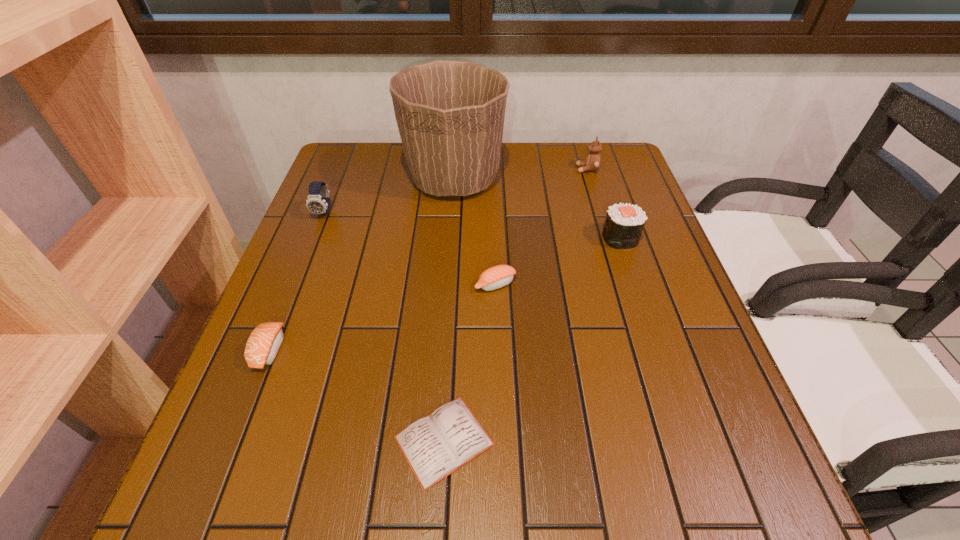
The image size is (960, 540). In order to click on free space at the left edge of the desktop in this screenshot , I will do `click(238, 377)`.

Locate an element on the screen. The image size is (960, 540). vacant space at the right edge of the desktop is located at coordinates (613, 266).

What are the coordinates of `free space at the far left corner` in the screenshot? It's located at (349, 159).

The image size is (960, 540). In order to click on vacant space that's between the sixth farthest object and the watch in this screenshot , I will do `click(297, 281)`.

You are a GUI agent. You are given a task and a screenshot of the screen. Output one action in this format:
    pyautogui.click(x=<x>, y=<y>)
    Task: Click on the unoccupied position between the watch and the tallest object
    This screenshot has height=540, width=960.
    Given the screenshot: What is the action you would take?
    pyautogui.click(x=390, y=195)

Locate an element on the screen. vacant area between the leftmost sushi and the diary is located at coordinates (356, 395).

Where is `free point between the second nearest object and the teddy bear`? This screenshot has width=960, height=540. free point between the second nearest object and the teddy bear is located at coordinates (428, 259).

Identify the location of free area in between the leftmost sushi and the diary. (356, 395).

Find the location of a particular element. The height and width of the screenshot is (540, 960). vacant space that's between the second farthest sushi and the fourth nearest object is located at coordinates (558, 261).

At what (x,y) coordinates should I click in order to perform the action: click on empty space between the second nearest object and the teddy bear. Please return your answer as a coordinate pair (x, y). Looking at the image, I should click on (428, 259).